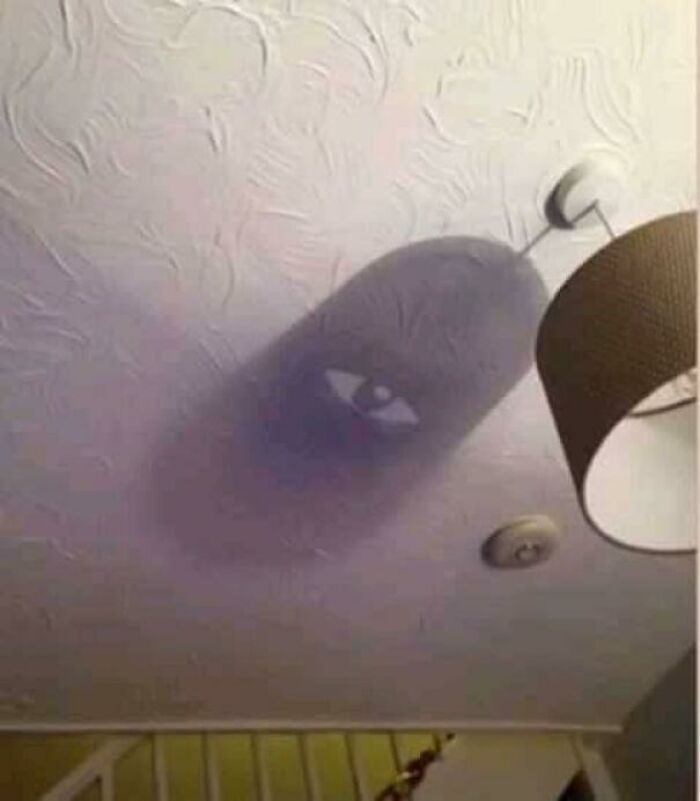
Find the location of a particular element. lampshade is located at coordinates (610, 308).